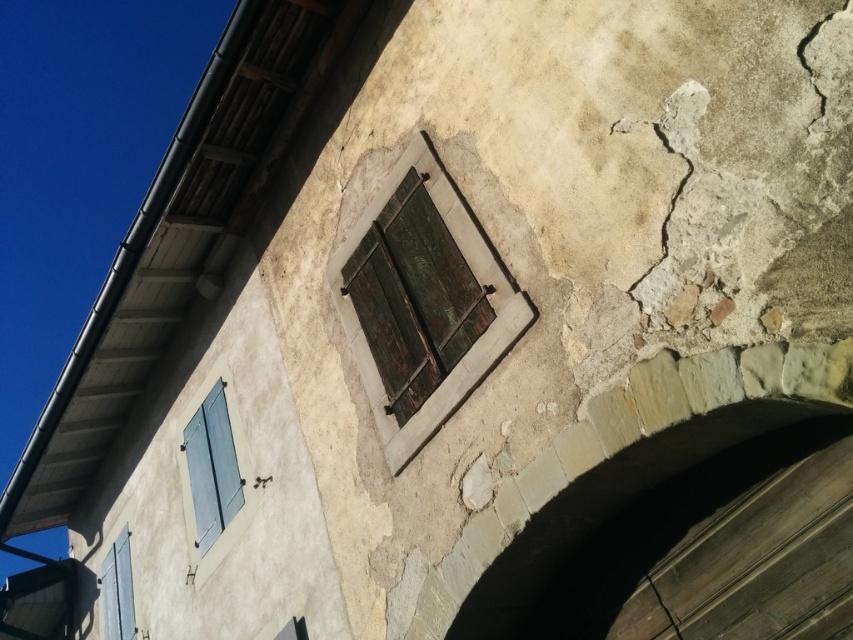
Question: Which point is farther to the camera?

Choices:
 (A) (349, 278)
 (B) (238, 488)
 (C) (676, 625)
 (D) (727, 435)

Answer: (B)

Question: Considering the real-world distances, which object is farthest from the matte gray shutters at lower left?

Choices:
 (A) stone archway at lower center
 (B) rusty wood window at center

Answer: (A)

Question: Which point is farther to the camera?

Choices:
 (A) (242, 492)
 (B) (560, 534)
 (C) (648, 586)
 (D) (370, 353)

Answer: (A)

Question: Is rusty wood window at center positioned before dark gray concrete crack at lower center?

Choices:
 (A) no
 (B) yes

Answer: (A)

Question: Can you confirm if stone archway at lower center is thinner than rusty wood window at center?

Choices:
 (A) yes
 (B) no

Answer: (B)

Question: Observing the image, what is the correct spatial positioning of rusty wood window at center in reference to blue painted wood shutters at lower left?

Choices:
 (A) above
 (B) below

Answer: (A)